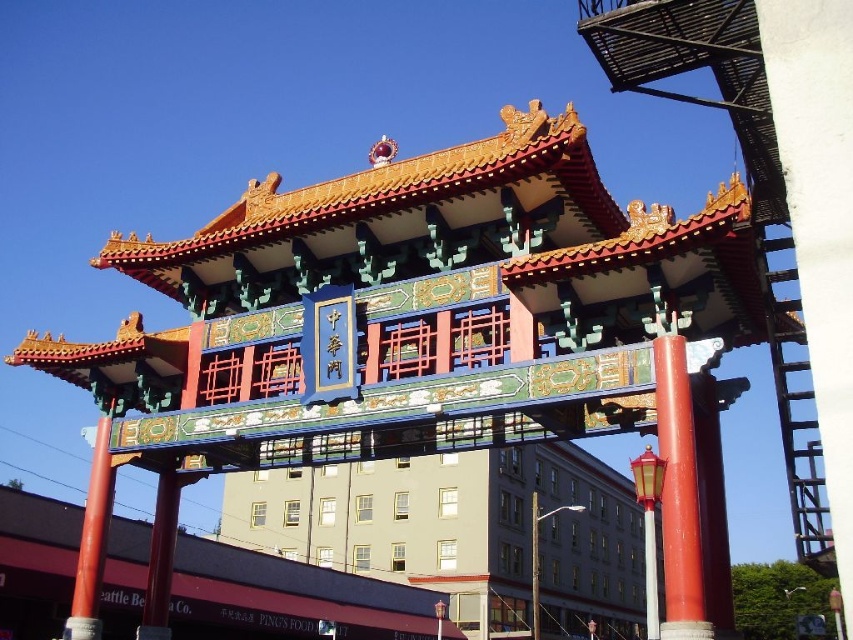
Can you confirm if smooth glossy red pillar at center is taller than smooth red pole at left?

In fact, smooth glossy red pillar at center may be shorter than smooth red pole at left.

Which is more to the right, smooth glossy red pillar at center or smooth red pole at left?

From the viewer's perspective, smooth glossy red pillar at center appears more on the right side.

Which is in front, point (686, 392) or point (96, 497)?

Point (686, 392)

Find the location of `smooth glossy red pillar at center`. smooth glossy red pillar at center is located at coordinates (677, 496).